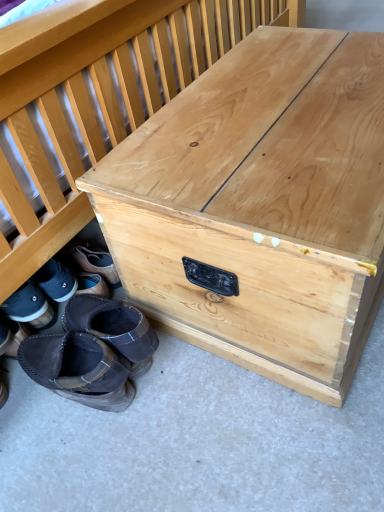
Question: Does leather boots at lower left, which is counted as the third footwear, starting from the left, have a greater width compared to natural wood trunk at center?

Choices:
 (A) yes
 (B) no

Answer: (B)

Question: Can you confirm if leather boots at lower left, which is counted as the third footwear, starting from the left, is taller than natural wood trunk at center?

Choices:
 (A) yes
 (B) no

Answer: (B)

Question: Considering the relative positions of leather boots at lower left, which is counted as the third footwear, starting from the left, and natural wood trunk at center in the image provided, is leather boots at lower left, which is counted as the third footwear, starting from the left, to the right of natural wood trunk at center from the viewer's perspective?

Choices:
 (A) yes
 (B) no

Answer: (B)

Question: From the image's perspective, is leather boots at lower left, positioned as the third footwear in right-to-left order, beneath natural wood trunk at center?

Choices:
 (A) yes
 (B) no

Answer: (A)

Question: Is leather boots at lower left, positioned as the third footwear in right-to-left order, positioned with its back to natural wood trunk at center?

Choices:
 (A) yes
 (B) no

Answer: (B)

Question: Would you say brown suede boot at lower left, acting as the 5th footwear starting from the right, is inside or outside black suede boot at lower left, the second footwear in the left-to-right sequence?

Choices:
 (A) outside
 (B) inside

Answer: (A)

Question: Looking at their shapes, would you say brown suede boot at lower left, acting as the 5th footwear starting from the right, is wider or thinner than black suede boot at lower left, the second footwear in the left-to-right sequence?

Choices:
 (A) wide
 (B) thin

Answer: (B)

Question: Considering the positions of brown suede boot at lower left, acting as the 5th footwear starting from the right, and black suede boot at lower left, the second footwear in the left-to-right sequence, in the image, is brown suede boot at lower left, acting as the 5th footwear starting from the right, bigger or smaller than black suede boot at lower left, the second footwear in the left-to-right sequence,?

Choices:
 (A) big
 (B) small

Answer: (A)

Question: From the image's perspective, is brown suede boot at lower left, acting as the 5th footwear starting from the right, located above or below black suede boot at lower left, marked as the fourth footwear in a right-to-left arrangement?

Choices:
 (A) below
 (B) above

Answer: (A)

Question: Is brown suede boot at lower left, the 2th footwear positioned from the right, situated inside dark brown suede moccasin at lower left, which appears as the first footwear when viewed from the right, or outside?

Choices:
 (A) outside
 (B) inside

Answer: (A)

Question: From the image's perspective, is brown suede boot at lower left, the 2th footwear positioned from the right, above or below dark brown suede moccasin at lower left, which appears as the first footwear when viewed from the right?

Choices:
 (A) below
 (B) above

Answer: (A)

Question: Is brown suede boot at lower left, the 2th footwear positioned from the right, to the left or to the right of dark brown suede moccasin at lower left, the fifth footwear in the left-to-right sequence, in the image?

Choices:
 (A) right
 (B) left

Answer: (B)

Question: Is point (82, 378) positioned closer to the camera than point (148, 367)?

Choices:
 (A) closer
 (B) farther

Answer: (A)

Question: Relative to brown suede boot at lower left, the 2th footwear positioned from the right, is natural wood trunk at center in front or behind?

Choices:
 (A) behind
 (B) front

Answer: (B)

Question: Does point (340, 225) appear closer or farther from the camera than point (107, 361)?

Choices:
 (A) farther
 (B) closer

Answer: (B)